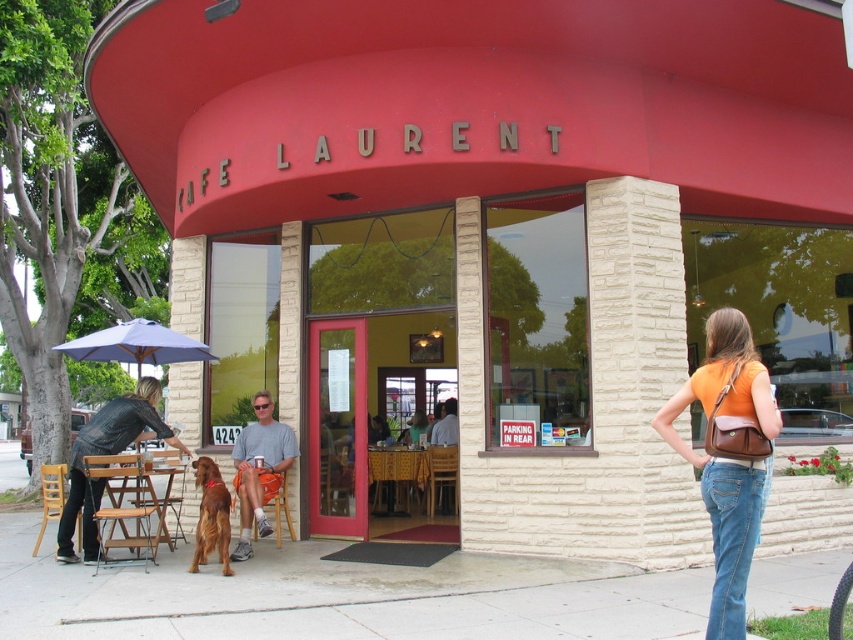
Does point (234, 490) lie behind point (154, 358)?

No, (234, 490) is closer to viewer.

Which is in front, point (268, 490) or point (158, 362)?

Positioned in front is point (268, 490).

Which is in front, point (268, 410) or point (90, 342)?

Positioned in front is point (90, 342).

The image size is (853, 640). I want to click on gray fabric shorts at lower left, so click(259, 468).

Consider the image. Who is positioned more to the right, denim jacket at lower left or shiny brown dog at lower left?

shiny brown dog at lower left

Who is positioned more to the left, denim jacket at lower left or shiny brown dog at lower left?

Positioned to the left is denim jacket at lower left.

Does point (115, 435) lie in front of point (224, 534)?

No, (115, 435) is behind (224, 534).

Locate an element on the screen. The height and width of the screenshot is (640, 853). denim jacket at lower left is located at coordinates 103,454.

Which is above, smooth concrete pavement at center or matte purple umbrella at left?

matte purple umbrella at left is higher up.

Is smooth concrete pavement at center smaller than matte purple umbrella at left?

Yes.

The width and height of the screenshot is (853, 640). I want to click on smooth concrete pavement at center, so click(x=343, y=596).